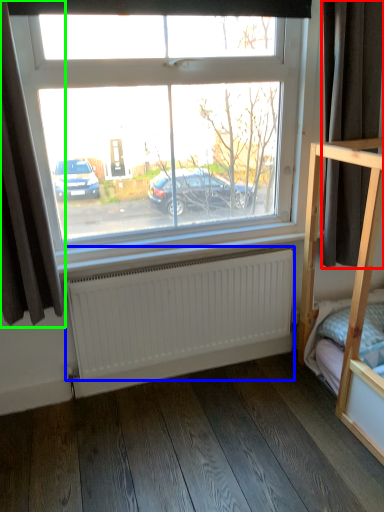
Question: Estimate the real-world distances between objects in this image. Which object is closer to curtain (highlighted by a red box), radiator (highlighted by a blue box) or curtain (highlighted by a green box)?

Choices:
 (A) radiator
 (B) curtain

Answer: (A)